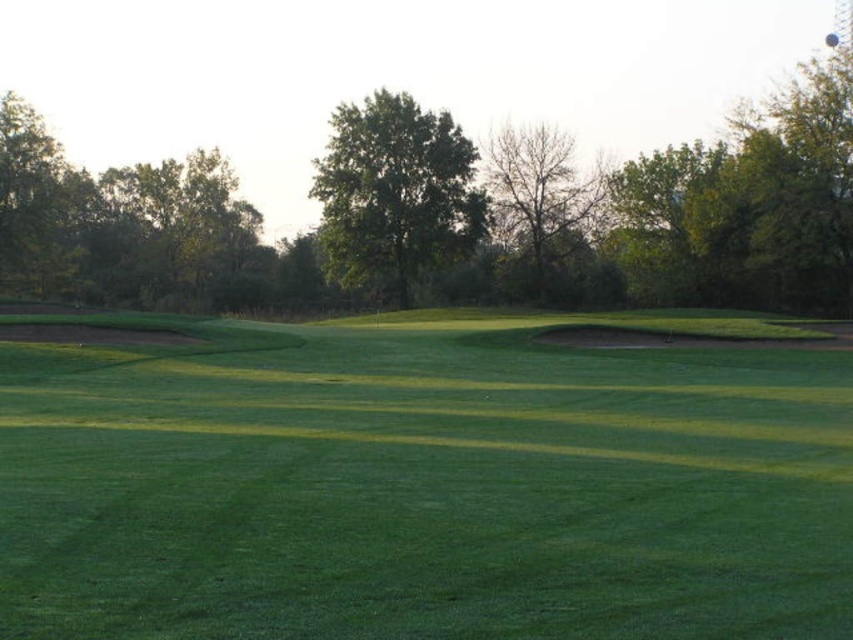
You are a golfer standing at the tee box, aiming to hit your ball over the green leafy tree at upper center and the bare branches at center. The course rules state that any shot exceeding 150 feet will incur a penalty. Based on the distance between the two objects, what is the maximum distance your shot can travel without penalty?

The green leafy tree at upper center is 61.36 feet from the bare branches at center. To avoid exceeding the 150 feet penalty, your shot can travel up to 150 feet. Since the distance between the two objects is 61.36 feet, the maximum safe distance would be 150 feet, ensuring you stay within the limit while clearing both obstacles.

You are a golfer standing on the fairway and see the green leafy tree at center and the bare branches at center. Which object would block your view more if you were to walk towards them?

The green leafy tree at center is larger in size than the bare branches at center, so it would block your view more as you walk towards them.